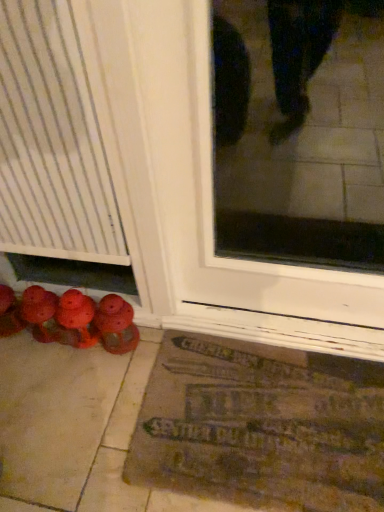
The image size is (384, 512). Find the location of `free point in front of matte red shoes at lower left, positioned as the 2th footwear in left-to-right order`. free point in front of matte red shoes at lower left, positioned as the 2th footwear in left-to-right order is located at coordinates (108, 390).